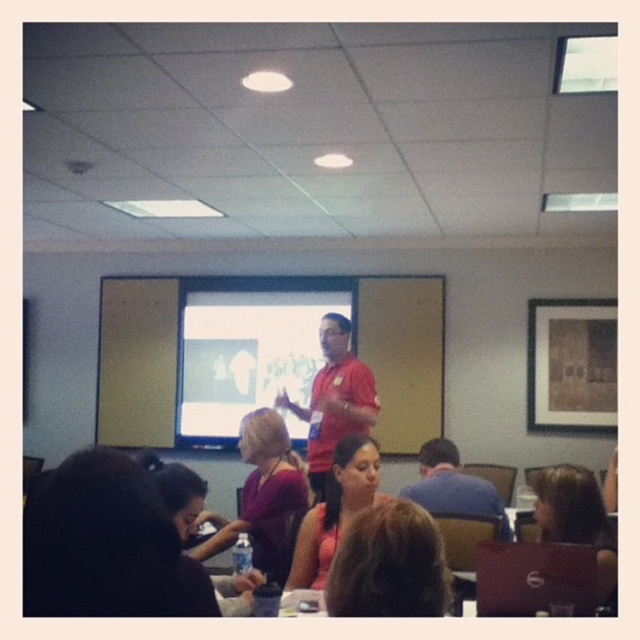
Is white glossy projection screen at center positioned behind matte purple blouse at center?

Yes, it is.

Which is below, white glossy projection screen at center or matte purple blouse at center?

matte purple blouse at center is below.

Find the location of `white glossy projection screen at center`. white glossy projection screen at center is located at coordinates (248, 348).

Based on the photo, which is more to the left, matte purple blouse at center or brown hair at lower right?

matte purple blouse at center

Is matte purple blouse at center positioned in front of brown hair at lower right?

No, it is behind brown hair at lower right.

Measure the distance between point (300, 490) and camera.

Point (300, 490) and camera are 3.16 meters apart from each other.

Find the location of a particular element. The height and width of the screenshot is (640, 640). matte purple blouse at center is located at coordinates (266, 497).

The height and width of the screenshot is (640, 640). In order to click on white glossy projection screen at center in this screenshot , I will do `click(248, 348)`.

Is white glossy projection screen at center smaller than brown hair at lower right?

Actually, white glossy projection screen at center might be larger than brown hair at lower right.

What do you see at coordinates (248, 348) in the screenshot? This screenshot has width=640, height=640. I see `white glossy projection screen at center` at bounding box center [248, 348].

I want to click on white glossy projection screen at center, so click(x=248, y=348).